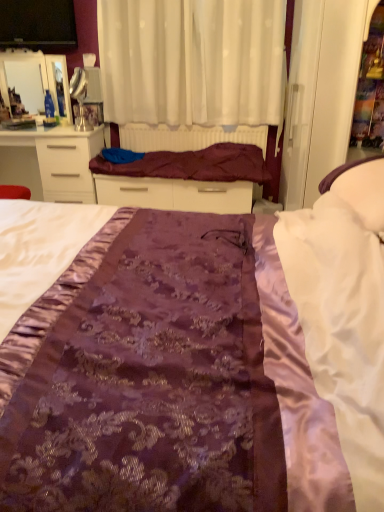
Where is `white glossy drawer at upper left`? white glossy drawer at upper left is located at coordinates (51, 162).

Describe the element at coordinates (185, 179) in the screenshot. I see `purple satin bed frame at center` at that location.

This screenshot has width=384, height=512. What do you see at coordinates (193, 164) in the screenshot?
I see `maroon satin blanket at center` at bounding box center [193, 164].

Where is `matte black tv at upper left`? The height and width of the screenshot is (512, 384). matte black tv at upper left is located at coordinates (38, 24).

I want to click on curtain that is above the purple satin bed frame at center (from a real-world perspective), so click(x=191, y=61).

Considering the positions of objects purple satin bed frame at center and white sheer curtain at upper center in the image provided, who is behind, purple satin bed frame at center or white sheer curtain at upper center?

Positioned behind is purple satin bed frame at center.

From a real-world perspective, is purple satin bed frame at center positioned above or below white sheer curtain at upper center?

purple satin bed frame at center is below white sheer curtain at upper center.

Considering the sizes of objects purple satin bed frame at center and white sheer curtain at upper center in the image provided, who is bigger, purple satin bed frame at center or white sheer curtain at upper center?

With larger size is white sheer curtain at upper center.

Does maroon satin blanket at center have a greater height compared to purple satin bed frame at center?

In fact, maroon satin blanket at center may be shorter than purple satin bed frame at center.

From the image's perspective, between maroon satin blanket at center and purple satin bed frame at center, which one is located above?

From the image's view, purple satin bed frame at center is above.

Measure the distance between maroon satin blanket at center and purple satin bed frame at center.

maroon satin blanket at center is 1.59 inches from purple satin bed frame at center.

Are maroon satin blanket at center and purple satin bed frame at center making contact?

Yes, maroon satin blanket at center is in contact with purple satin bed frame at center.

Is white satin pillow at right completely or partially outside of white glossy drawer at upper left?

Yes, white satin pillow at right is not within white glossy drawer at upper left.

Is white satin pillow at right further to camera compared to white glossy drawer at upper left?

No, white satin pillow at right is closer to the viewer.

From the image's perspective, which object appears higher, white satin pillow at right or white glossy drawer at upper left?

white glossy drawer at upper left.

Which object is thinner, white satin pillow at right or white glossy drawer at upper left?

white satin pillow at right.

Can you tell me how much maroon satin blanket at center and white satin pillow at right differ in facing direction?

maroon satin blanket at center and white satin pillow at right are facing 90.4 degrees away from each other.

In terms of size, does maroon satin blanket at center appear bigger or smaller than white satin pillow at right?

In the image, maroon satin blanket at center appears to be larger than white satin pillow at right.

Based on the photo, do you think maroon satin blanket at center is within white satin pillow at right, or outside of it?

maroon satin blanket at center cannot be found inside white satin pillow at right.

From a real-world perspective, between maroon satin blanket at center and white satin pillow at right, who is vertically higher?

In real-world perspective, white satin pillow at right is above.

Consider the image. How different are the orientations of purple satin bed at center and white sheer curtain at upper center in degrees?

The angle between the facing direction of purple satin bed at center and the facing direction of white sheer curtain at upper center is 88.3 degrees.

In terms of width, does purple satin bed at center look wider or thinner when compared to white sheer curtain at upper center?

Considering their sizes, purple satin bed at center looks broader than white sheer curtain at upper center.

Consider the image. How much distance is there between purple satin bed at center and white sheer curtain at upper center?

purple satin bed at center is 7.33 feet from white sheer curtain at upper center.

This screenshot has height=512, width=384. Identify the location of curtain behind the purple satin bed at center. (191, 61).

Does point (52, 44) lie in front of point (168, 72)?

No.

Based on their sizes in the image, would you say matte black tv at upper left is bigger or smaller than white sheer curtain at upper center?

Clearly, matte black tv at upper left is smaller in size than white sheer curtain at upper center.

From the image's perspective, which is below, matte black tv at upper left or white sheer curtain at upper center?

white sheer curtain at upper center appears lower in the image.

From a real-world perspective, which object rests below the other?

From a 3D spatial view, white sheer curtain at upper center is below.

Considering the sizes of objects white sheer curtain at upper center and white glossy drawer at upper left in the image provided, who is smaller, white sheer curtain at upper center or white glossy drawer at upper left?

Smaller between the two is white sheer curtain at upper center.

Which is closer to the camera, (185, 44) or (28, 158)?

The point (185, 44) is closer.

From the image's perspective, which one is positioned lower, white sheer curtain at upper center or white glossy drawer at upper left?

white glossy drawer at upper left is shown below in the image.

This screenshot has height=512, width=384. I want to click on bed frame located behind the white sheer curtain at upper center, so click(x=185, y=179).

Identify the location of bed frame on the right of maroon satin blanket at center. The image size is (384, 512). (185, 179).

Estimate the real-world distances between objects in this image. Which object is further from purple satin bed frame at center, white glossy drawer at upper left or matte black tv at upper left?

Based on the image, matte black tv at upper left appears to be further to purple satin bed frame at center.

From the image, which object appears to be farther from purple satin bed at center, white glossy drawer at upper left or matte black tv at upper left?

Based on the image, matte black tv at upper left appears to be further to purple satin bed at center.

Considering their positions, is purple satin bed at center positioned closer to matte black tv at upper left than white satin pillow at right?

Based on the image, white satin pillow at right appears to be nearer to matte black tv at upper left.

Which object lies further to the anchor point white glossy drawer at upper left, white satin pillow at right or purple satin bed frame at center?

Based on the image, white satin pillow at right appears to be further to white glossy drawer at upper left.

When comparing their distances from purple satin bed frame at center, does purple satin bed at center or white sheer curtain at upper center seem further?

purple satin bed at center is positioned further to the anchor purple satin bed frame at center.

Looking at the image, which one is located closer to purple satin bed frame at center, white satin pillow at right or white sheer curtain at upper center?

white sheer curtain at upper center lies closer to purple satin bed frame at center than the other object.

Which object lies nearer to the anchor point white sheer curtain at upper center, white satin pillow at right or maroon satin blanket at center?

maroon satin blanket at center.

Looking at the image, which one is located closer to white sheer curtain at upper center, matte black tv at upper left or purple satin bed at center?

matte black tv at upper left.

Identify the location of blanket between matte black tv at upper left and white sheer curtain at upper center. The image size is (384, 512). (193, 164).

I want to click on bed frame between white sheer curtain at upper center and maroon satin blanket at center vertically, so click(185, 179).

Identify the location of pillow between purple satin bed at center and purple satin bed frame at center along the z-axis. (361, 189).

You are a GUI agent. You are given a task and a screenshot of the screen. Output one action in this format:
    pyautogui.click(x=<x>, y=<y>)
    Task: Click on the blanket between purple satin bed at center and matte black tv at upper left from front to back
    This screenshot has height=512, width=384.
    Given the screenshot: What is the action you would take?
    pyautogui.click(x=193, y=164)